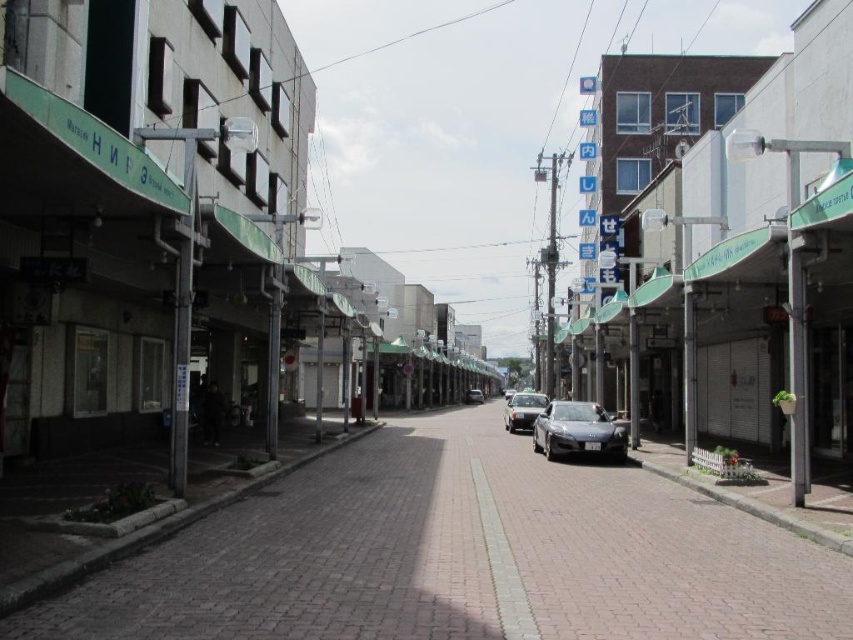
Between brick pavement at center and shiny silver car at center, which one appears on the left side from the viewer's perspective?

brick pavement at center is more to the left.

Between point (584, 593) and point (544, 442), which one is positioned behind?

Point (544, 442)

Between point (483, 496) and point (606, 429), which one is positioned in front?

Positioned in front is point (483, 496).

This screenshot has height=640, width=853. What are the coordinates of `brick pavement at center` in the screenshot? It's located at (462, 556).

Does satin black car at center have a greater width compared to satin silver car at center?

Correct, the width of satin black car at center exceeds that of satin silver car at center.

Who is higher up, satin black car at center or satin silver car at center?

Positioned higher is satin black car at center.

The height and width of the screenshot is (640, 853). Describe the element at coordinates (523, 410) in the screenshot. I see `satin black car at center` at that location.

Locate an element on the screen. The width and height of the screenshot is (853, 640). satin black car at center is located at coordinates (523, 410).

In the scene shown: Is brick pavement at center positioned behind satin silver car at center?

That is False.

Who is more forward, (x=397, y=540) or (x=477, y=403)?

Point (x=397, y=540) is in front.

This screenshot has width=853, height=640. I want to click on brick pavement at center, so click(x=462, y=556).